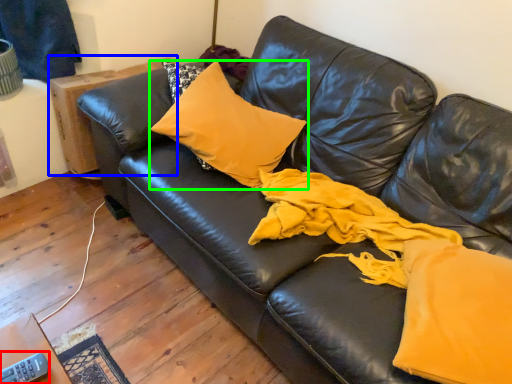
Question: Estimate the real-world distances between objects in this image. Which object is closer to remote (highlighted by a red box), table (highlighted by a blue box) or pillow (highlighted by a green box)?

Choices:
 (A) table
 (B) pillow

Answer: (B)